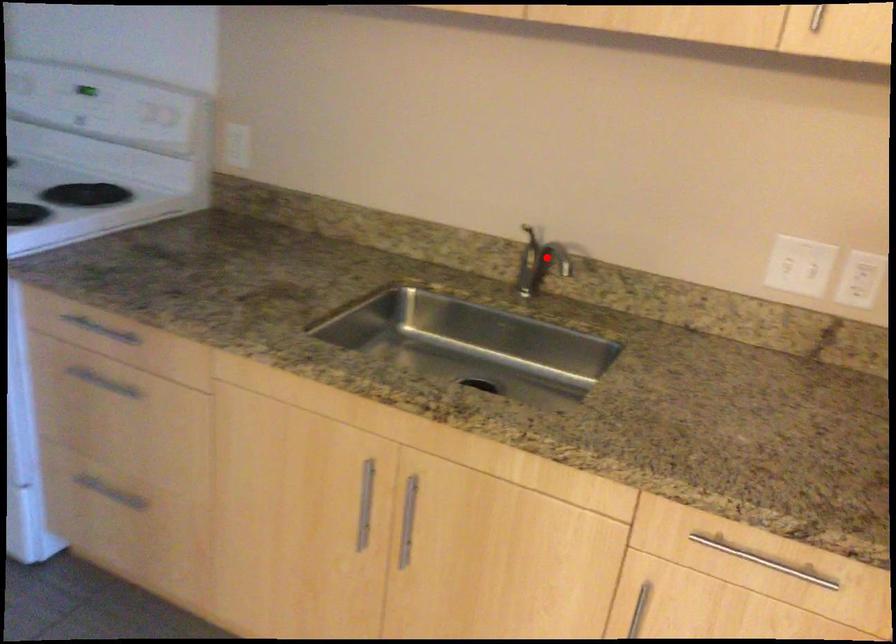
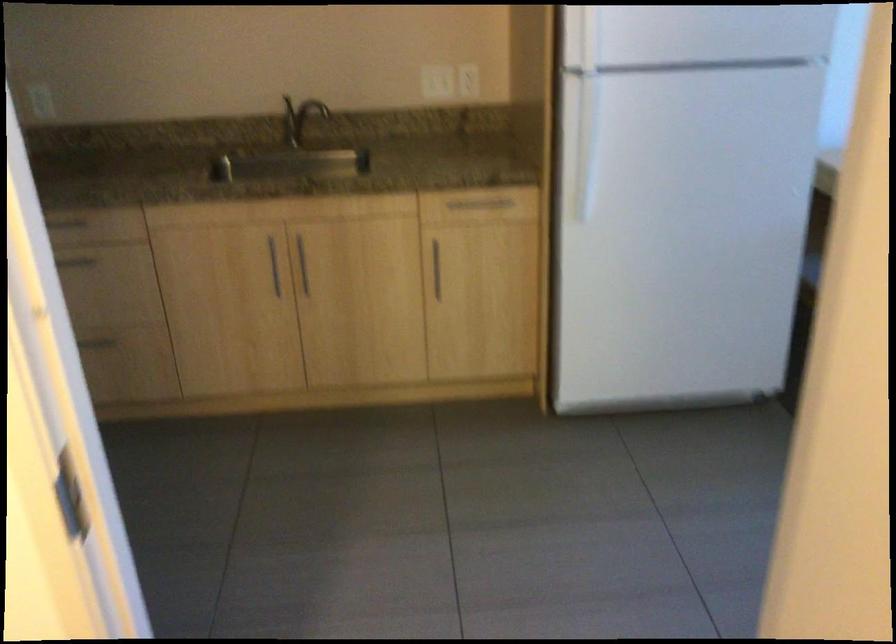
Question: I am providing you with two images of the same scene from different viewpoints. A red point is marked on the first image. Can you still see the location of the red point in image 2?

Choices:
 (A) Yes
 (B) No

Answer: (A)